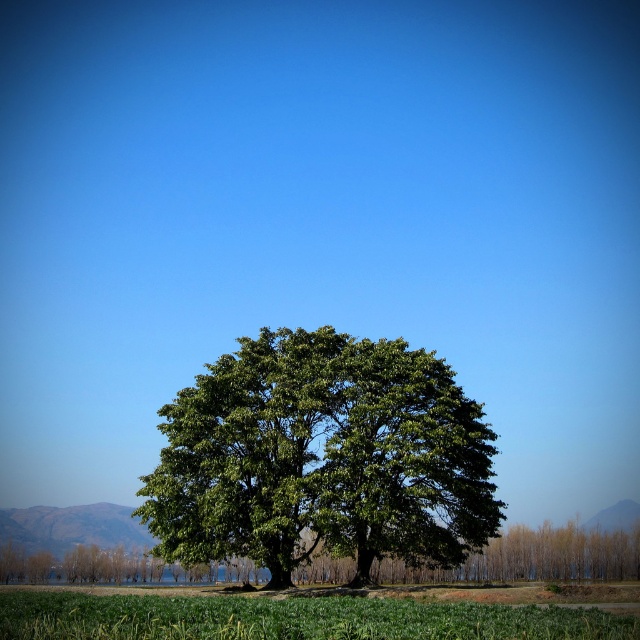
Is green leafy tree at center behind green grass at lower center?

Yes, it is behind green grass at lower center.

Is point (348, 468) positioned after point (264, 614)?

Yes.

Which is behind, point (296, 563) or point (570, 614)?

The point (296, 563) is more distant.

Find the location of a particular element. green leafy tree at center is located at coordinates (323, 458).